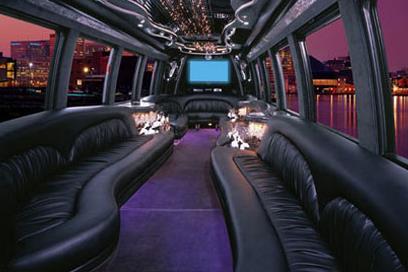
Identify the location of display. (208, 69).